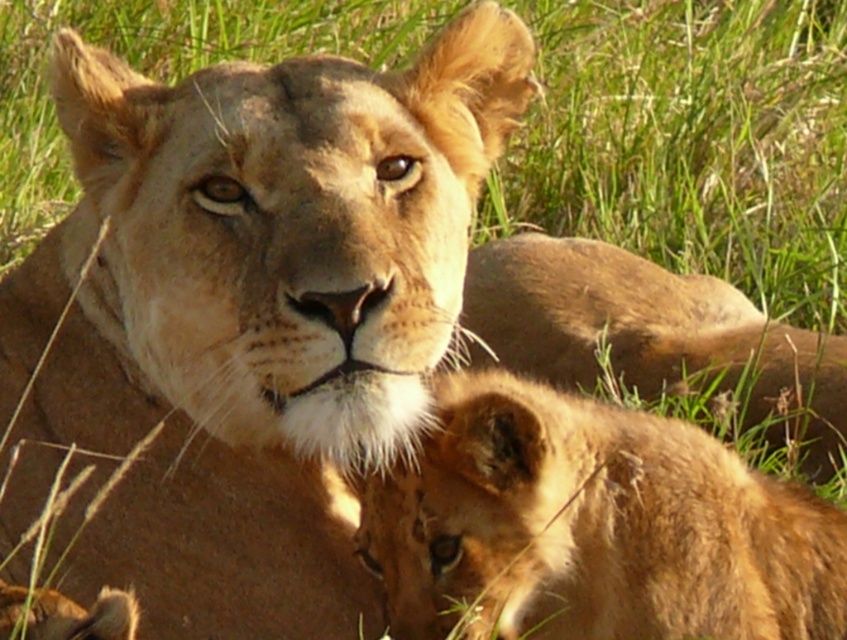
Looking at the golden fur lion at center and the golden fur paw at lower left in the image, which one is positioned to the right side?

The golden fur lion at center is positioned to the right of the golden fur paw at lower left.

You are a wildlife photographer trying to capture a clear shot of both the golden fur lion at center and the golden fur paw at lower left. Given their sizes, which one will appear larger in your photo?

The golden fur lion at center will appear larger in the photo because it is much taller than the golden fur paw at lower left.